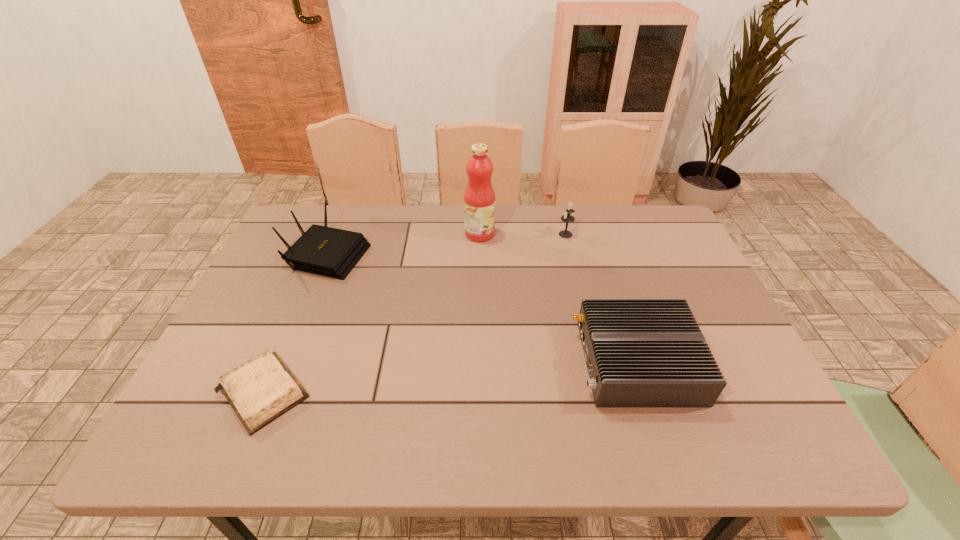
The width and height of the screenshot is (960, 540). Identify the location of object that is at the far left corner. (321, 250).

This screenshot has width=960, height=540. What are the coordinates of `object that is positioned at the near left corner` in the screenshot? It's located at (260, 390).

What are the coordinates of `free location at the far edge` in the screenshot? It's located at [x=557, y=224].

Where is `vacant space at the near edge of the desktop`? This screenshot has width=960, height=540. vacant space at the near edge of the desktop is located at coordinates (672, 428).

What are the coordinates of `free space at the right edge of the desktop` in the screenshot? It's located at (671, 267).

You are a GUI agent. You are given a task and a screenshot of the screen. Output one action in this format:
    pyautogui.click(x=<x>, y=<y>)
    Task: Click on the vacant space at the near left corner
    Image resolution: width=960 pixels, height=540 pixels.
    Given the screenshot: What is the action you would take?
    point(188,421)

What are the coordinates of `free spot between the fruit juice and the candle holder` in the screenshot? It's located at (522, 234).

What are the coordinates of `free space between the third object from right to left and the shorter router` in the screenshot? It's located at (559, 298).

Locate an element on the screen. This screenshot has height=540, width=960. vacant region between the farther router and the tallest object is located at coordinates (403, 243).

I want to click on free area in between the candle holder and the tallest object, so click(522, 234).